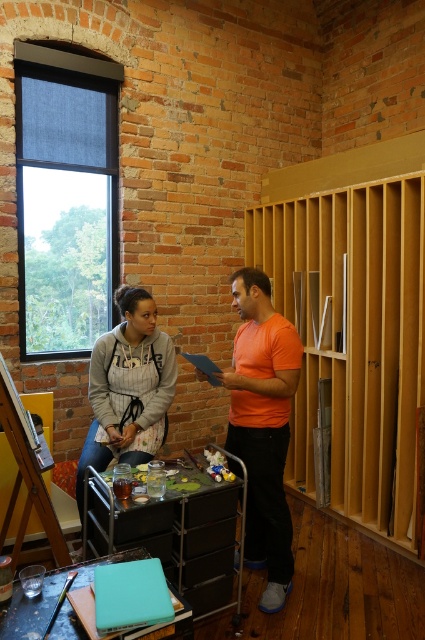
Question: Estimate the real-world distances between objects in this image. Which object is closer to the orange matte shirt at center?

Choices:
 (A) matte gray hoodie at center
 (B) wooden easel at lower left
 (C) metallic silver cart at center
 (D) wooden at right

Answer: (C)

Question: Does matte gray hoodie at center have a greater width compared to wooden easel at lower left?

Choices:
 (A) no
 (B) yes

Answer: (B)

Question: Which object is farther from the camera taking this photo?

Choices:
 (A) metallic silver cart at center
 (B) wooden easel at lower left
 (C) orange matte shirt at center
 (D) matte gray hoodie at center

Answer: (D)

Question: Which object is positioned closest to the metallic silver cart at center?

Choices:
 (A) wooden easel at lower left
 (B) matte gray hoodie at center
 (C) orange matte shirt at center
 (D) wooden at right

Answer: (C)

Question: Can you confirm if orange matte shirt at center is thinner than matte gray hoodie at center?

Choices:
 (A) no
 (B) yes

Answer: (B)

Question: Does orange matte shirt at center appear on the right side of metallic silver cart at center?

Choices:
 (A) no
 (B) yes

Answer: (B)